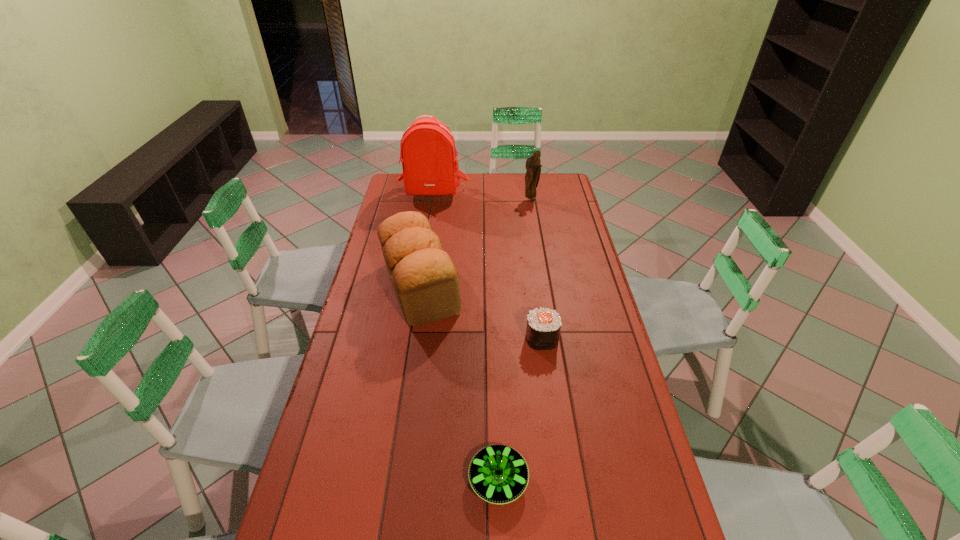
Where is `the tallest object`? This screenshot has width=960, height=540. the tallest object is located at coordinates (428, 150).

Find the location of a particular element. figurine is located at coordinates (533, 164).

Find the location of a particular element. This screenshot has width=960, height=540. bread is located at coordinates (424, 278).

Where is `sushi`? Image resolution: width=960 pixels, height=540 pixels. sushi is located at coordinates (543, 328).

The image size is (960, 540). Identify the location of the shortest object. (498, 474).

The width and height of the screenshot is (960, 540). I want to click on saucer, so click(498, 474).

Locate an element on the screen. vacant space situated 0.260m on the main compartment of the tallest object is located at coordinates (426, 237).

You are a GUI agent. You are given a task and a screenshot of the screen. Output one action in this format:
    pyautogui.click(x=<x>, y=<y>)
    Task: Click on the free spot located on the front-facing side of the figurine
    
    Given the screenshot: What is the action you would take?
    pyautogui.click(x=533, y=213)

Find the location of `vacant space located on the front of the bread`. vacant space located on the front of the bread is located at coordinates (402, 408).

Locate an element on the screen. This screenshot has height=540, width=960. free space located on the right of the second shortest object is located at coordinates (596, 339).